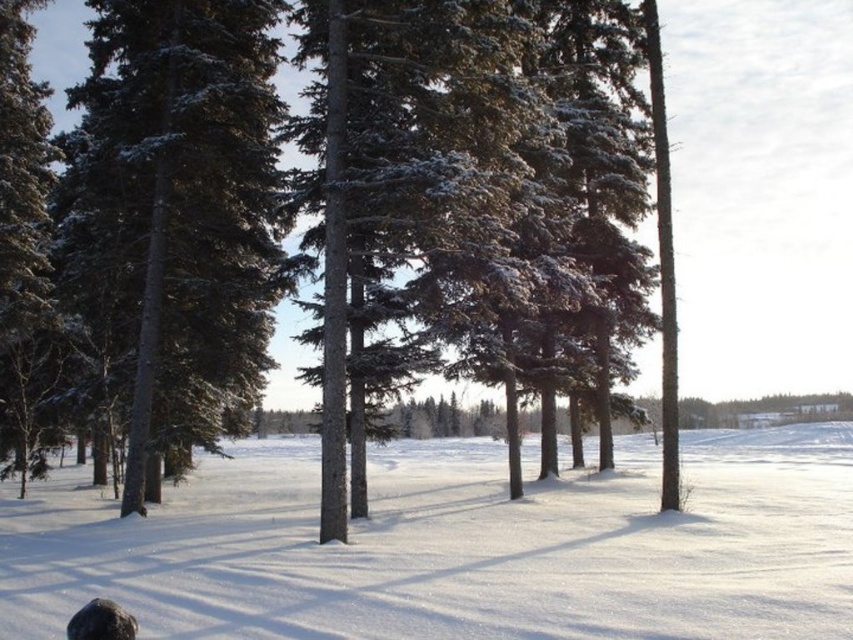
The width and height of the screenshot is (853, 640). Describe the element at coordinates (457, 547) in the screenshot. I see `white powdery snow at center` at that location.

Can you confirm if white powdery snow at center is wider than green textured pine tree at left?

Indeed, white powdery snow at center has a greater width compared to green textured pine tree at left.

Who is more forward, (257, 627) or (154, 220)?

Positioned in front is point (257, 627).

You are a GUI agent. You are given a task and a screenshot of the screen. Output one action in this format:
    pyautogui.click(x=<x>, y=<y>)
    Task: Click on the white powdery snow at center
    This screenshot has width=853, height=640.
    Given the screenshot: What is the action you would take?
    pyautogui.click(x=457, y=547)